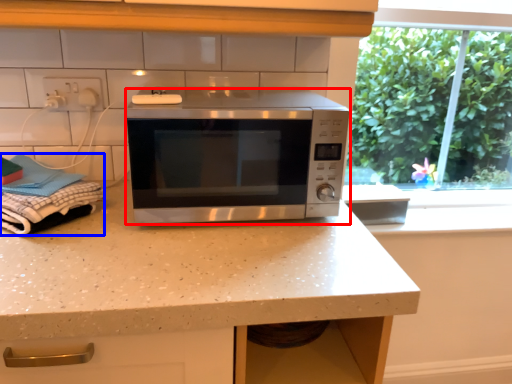
Question: Among these objects, which one is nearest to the camera, microwave oven (highlighted by a red box) or laundry (highlighted by a blue box)?

Choices:
 (A) microwave oven
 (B) laundry

Answer: (B)